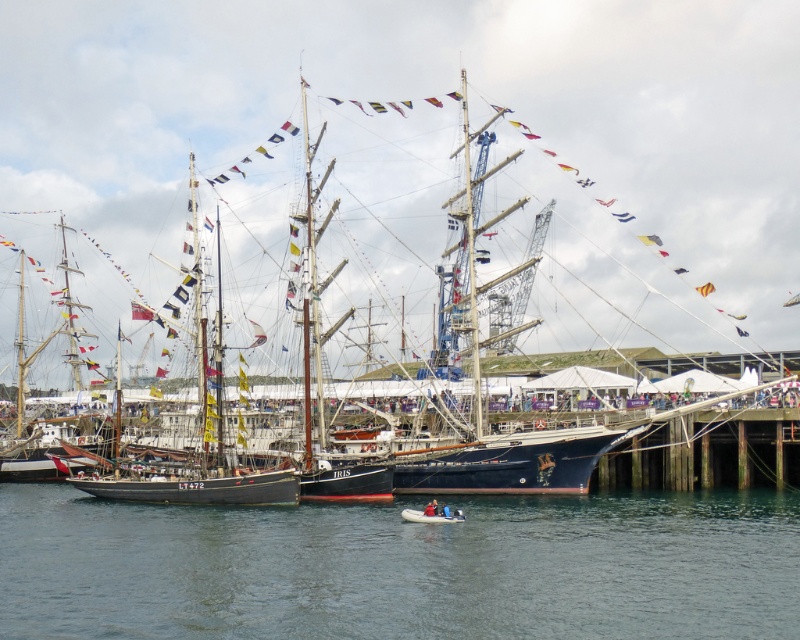
Question: Can you confirm if clear blue water at center is bigger than rubber dinghy at lower center?

Choices:
 (A) yes
 (B) no

Answer: (A)

Question: Is dark blue wooden ship at center behind rubber dinghy at lower center?

Choices:
 (A) yes
 (B) no

Answer: (A)

Question: Which object is farther from the camera taking this photo?

Choices:
 (A) clear blue water at center
 (B) rubber dinghy at lower center

Answer: (B)

Question: Based on their relative distances, which object is nearer to the rubber dinghy at lower center?

Choices:
 (A) dark blue wooden ship at center
 (B) clear blue water at center

Answer: (B)

Question: Which point is closer to the camera?

Choices:
 (A) (760, 102)
 (B) (416, 515)

Answer: (B)

Question: Considering the relative positions of dark blue wooden ship at center and clear blue water at center in the image provided, where is dark blue wooden ship at center located with respect to clear blue water at center?

Choices:
 (A) above
 (B) below

Answer: (A)